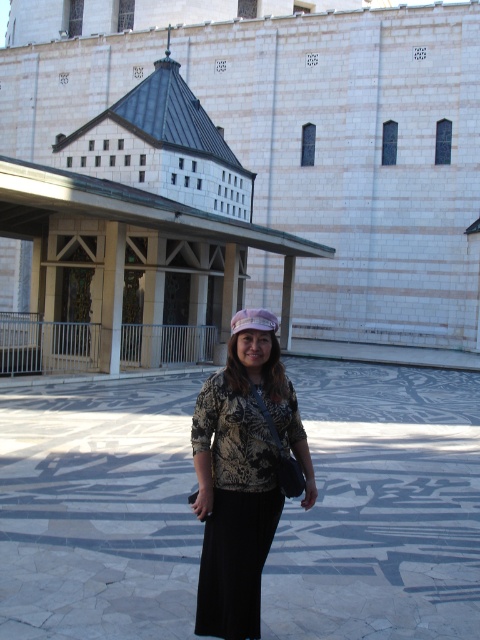
Consider the image. Can you confirm if printed fabric blouse at center is smaller than matte pink fabric hat at center?

Yes, printed fabric blouse at center is smaller than matte pink fabric hat at center.

Is printed fabric blouse at center further to the viewer compared to matte pink fabric hat at center?

No.

Where is `printed fabric blouse at center`? printed fabric blouse at center is located at coordinates (241, 480).